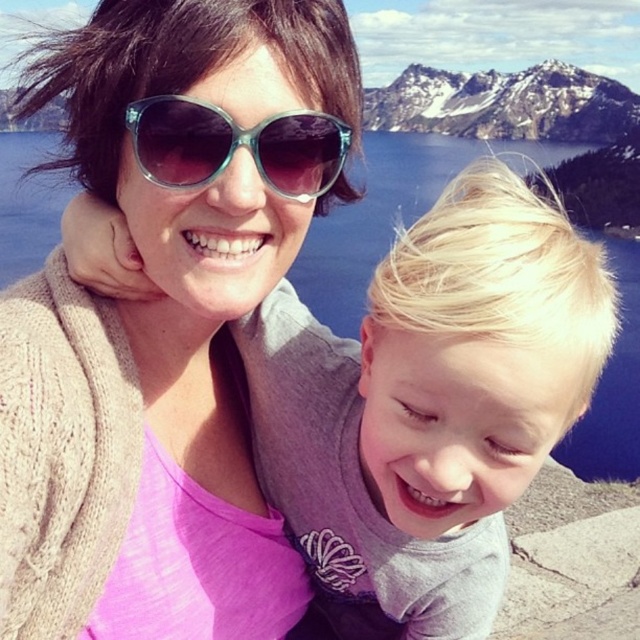
Who is positioned more to the left, blonde hair at center or blue glassy water at center?

blue glassy water at center

Does blonde hair at center appear on the left side of blue glassy water at center?

In fact, blonde hair at center is to the right of blue glassy water at center.

Describe the element at coordinates (429, 404) in the screenshot. The height and width of the screenshot is (640, 640). I see `blonde hair at center` at that location.

I want to click on blonde hair at center, so click(x=429, y=404).

Can you confirm if matte black sunglasses at upper center is wider than translucent teal sunglasses at center?

Indeed, matte black sunglasses at upper center has a greater width compared to translucent teal sunglasses at center.

Is matte black sunglasses at upper center positioned in front of translucent teal sunglasses at center?

Yes.

Is point (260, 161) farther from camera compared to point (138, 129)?

Yes, point (260, 161) is farther from viewer.

Identify the location of matte black sunglasses at upper center. This screenshot has width=640, height=640. (166, 321).

Who is more forward, (384,237) or (406,93)?

Point (384,237) is more forward.

Does blue glassy water at center come behind snowy granite mountain at upper center?

That is False.

Is point (19, 266) positioned in front of point (438, 93)?

Yes, point (19, 266) is in front of point (438, 93).

The height and width of the screenshot is (640, 640). I want to click on blue glassy water at center, so click(372, 220).